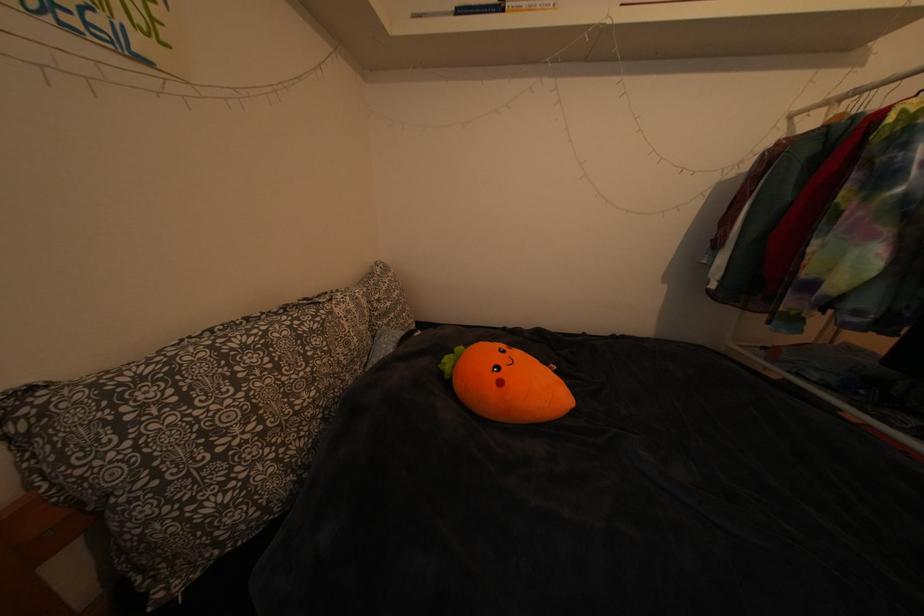
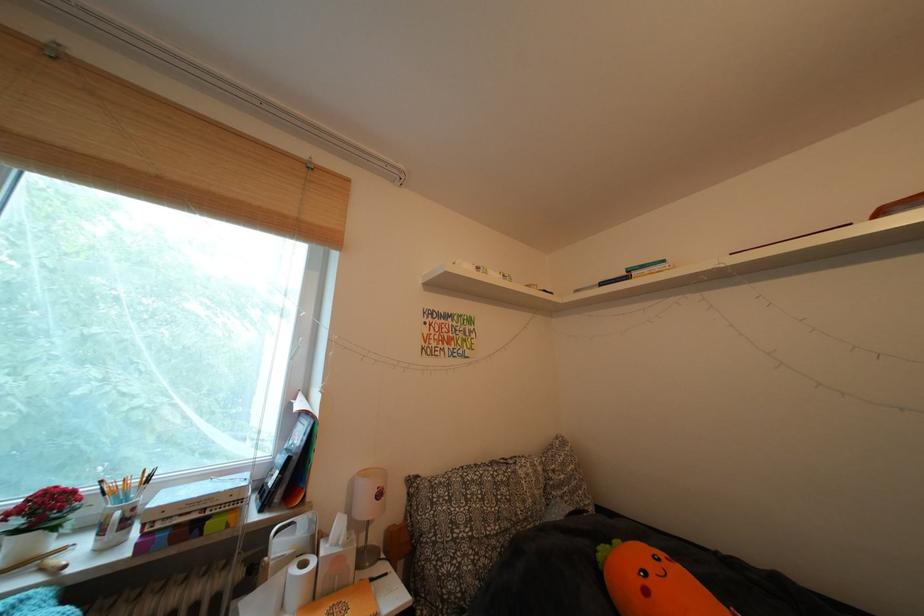
Find the pixel in the second image that matches (511,389) in the first image.

(657, 597)